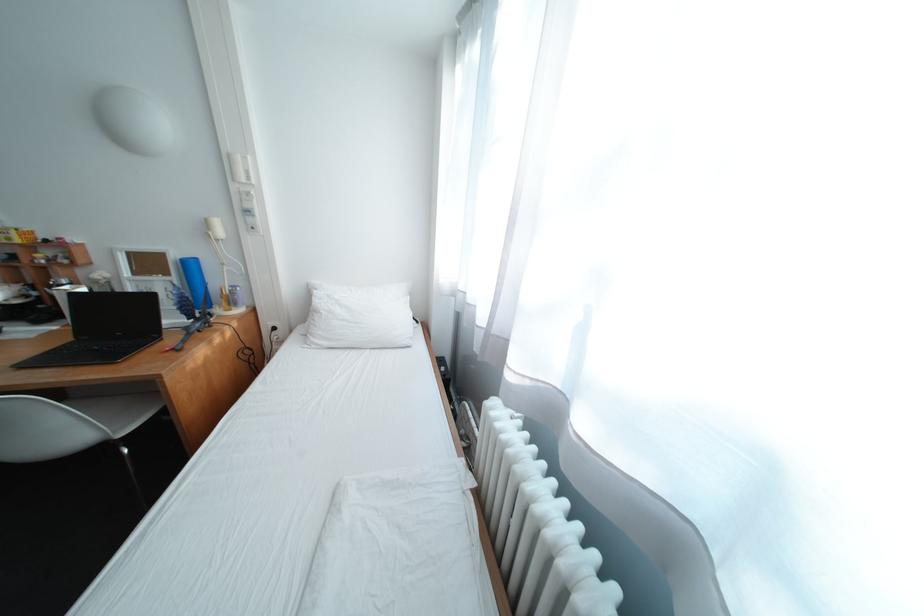
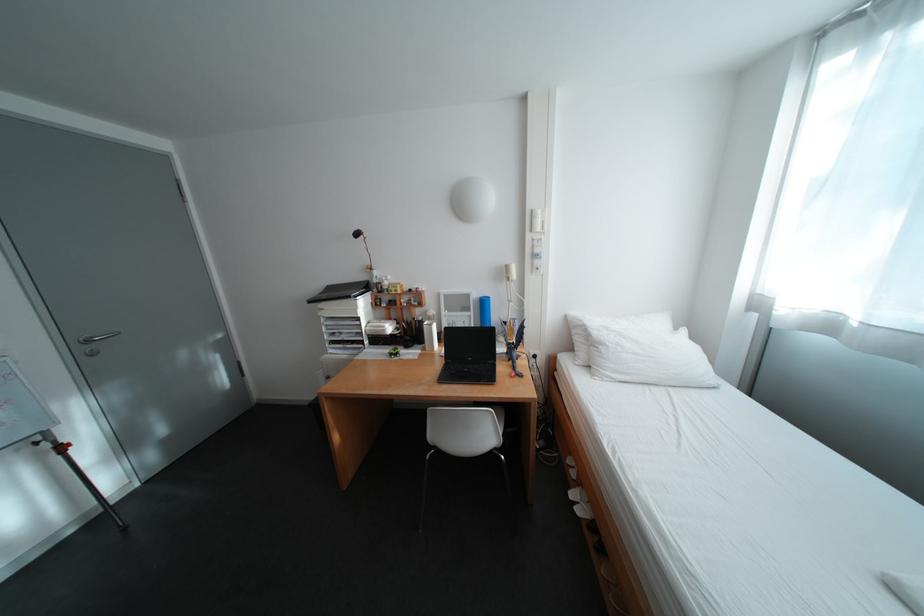
Locate, in the second image, the point that corresponds to point (187, 280) in the first image.

(484, 314)